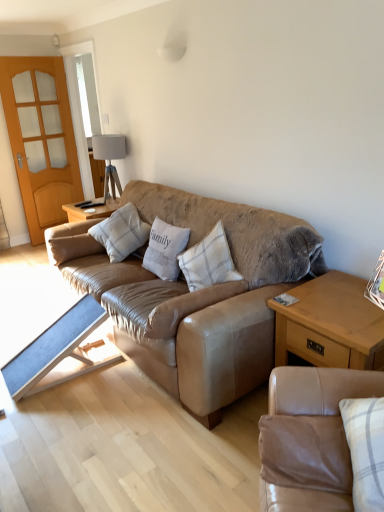
Find the location of `free point above light wood/texture side table at lower right, which is the first table from right to left (from a real-world perspective)`. free point above light wood/texture side table at lower right, which is the first table from right to left (from a real-world perspective) is located at coordinates (346, 298).